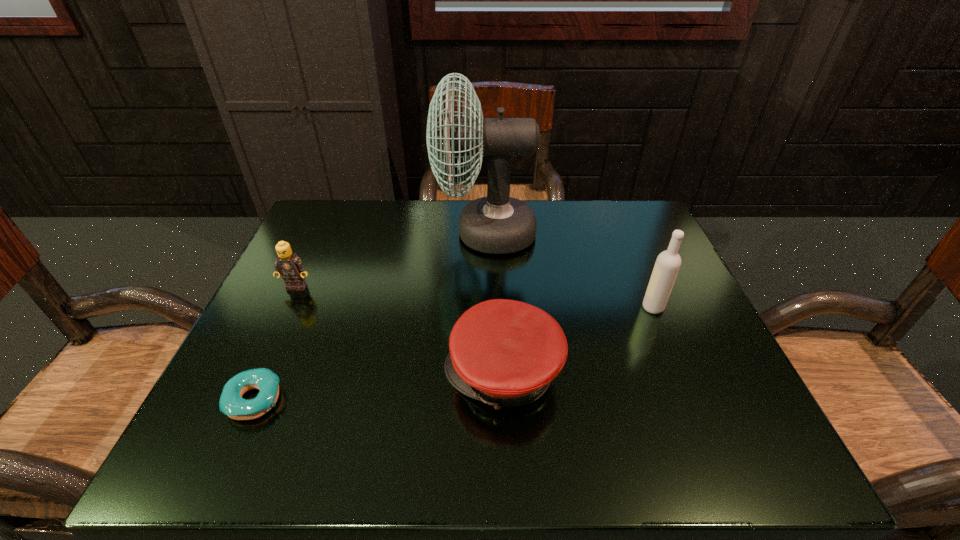
At what (x,y) coordinates should I click in order to perform the action: click on free location located in front of the farthest object where the airflow is directed. Please return your answer as a coordinate pair (x, y). Looking at the image, I should click on (399, 233).

Image resolution: width=960 pixels, height=540 pixels. I want to click on vacant space located on the back of the rightmost object, so click(622, 233).

You are a GUI agent. You are given a task and a screenshot of the screen. Output one action in this format:
    pyautogui.click(x=<x>, y=<y>)
    Task: Click on the free space located 0.240m in front of the third shortest object
    This screenshot has width=960, height=540.
    Given the screenshot: What is the action you would take?
    pyautogui.click(x=252, y=384)

Identify the location of vacant position located 0.140m on the front of the cap with an emblem. (365, 374).

Where is `free space located on the front of the cap with an emblem`? This screenshot has height=540, width=960. free space located on the front of the cap with an emblem is located at coordinates (376, 374).

What are the coordinates of `vacant region located 0.120m on the front of the cap with an emblem` in the screenshot? It's located at (376, 374).

This screenshot has width=960, height=540. Find the location of `free spot located on the right of the shortest object`. free spot located on the right of the shortest object is located at coordinates click(x=484, y=400).

In order to click on object at the far edge in this screenshot , I will do `click(497, 224)`.

The width and height of the screenshot is (960, 540). I want to click on cap situated at the near edge, so click(505, 353).

Find the location of a particular element. The image size is (960, 540). doughnut that is at the near edge is located at coordinates (231, 403).